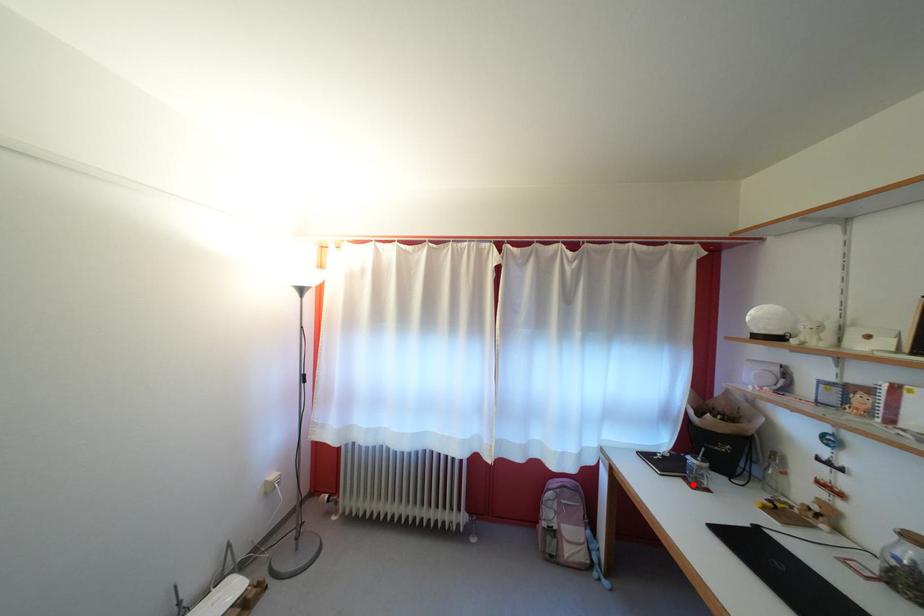
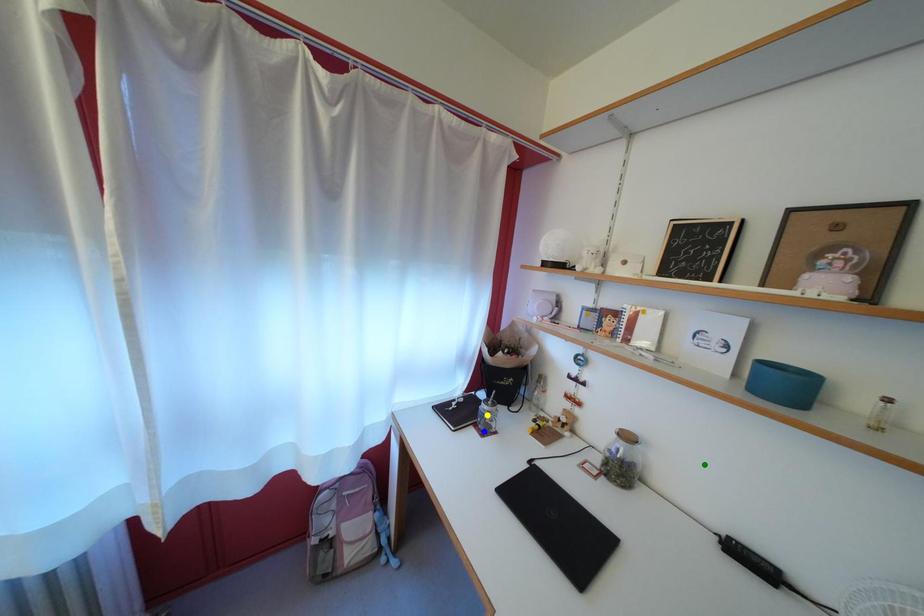
Question: I am providing you with two images of the same scene from different viewpoints. A red point is marked on the first image. You are given multiple points on the second image. Can you choose the point in image 2 that corresponds to the point in image 1?

Choices:
 (A) blue point
 (B) yellow point
 (C) green point

Answer: (A)